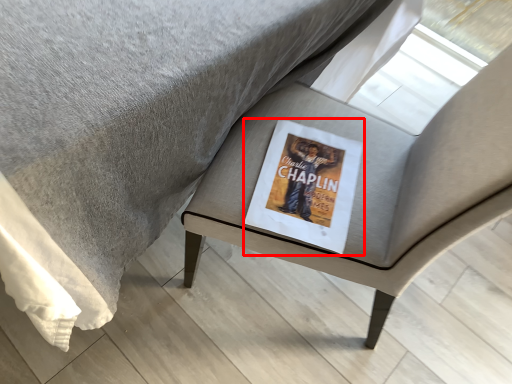
Question: Observing the image, what is the correct spatial positioning of paperback book (annotated by the red box) in reference to chair?

Choices:
 (A) right
 (B) left

Answer: (B)